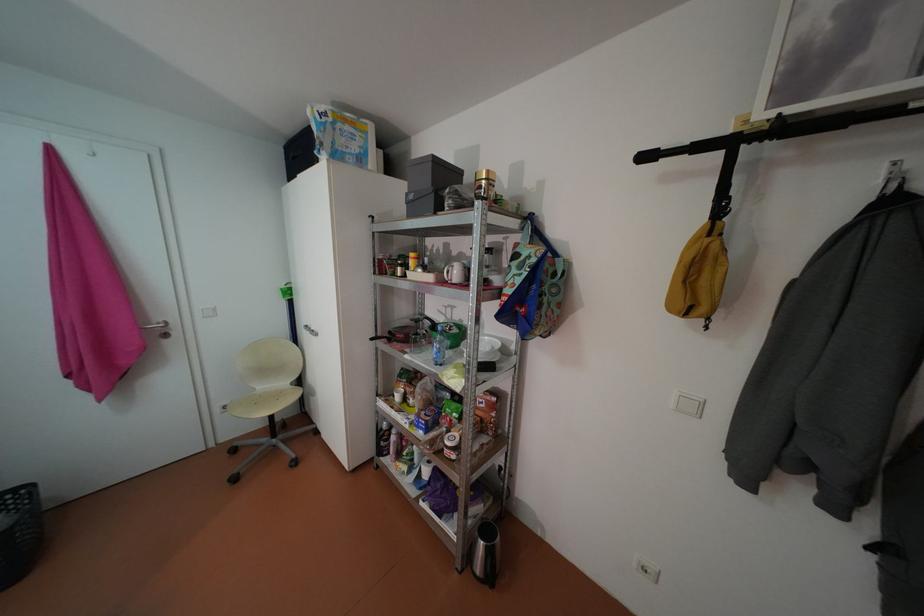
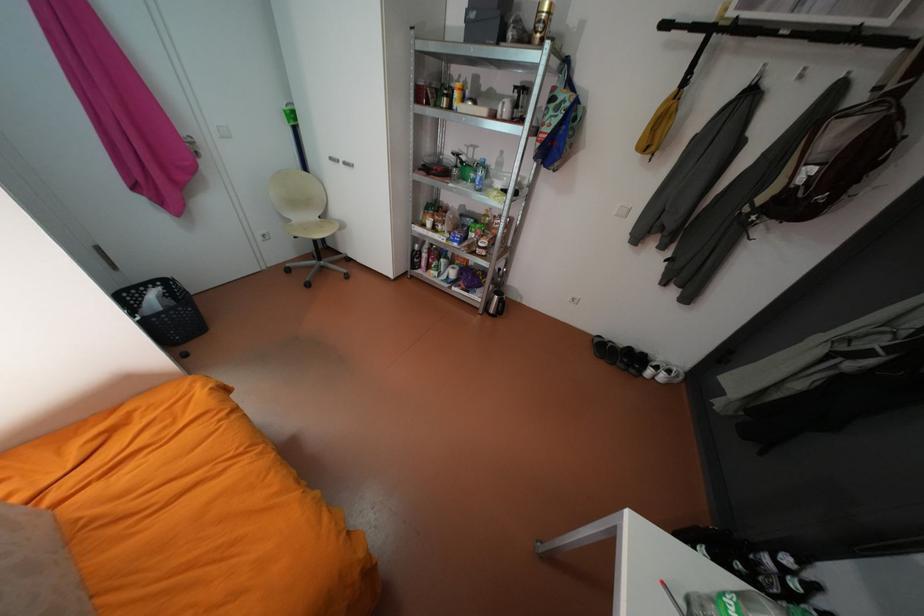
In the second image, find the point that corresponds to point (391, 450) in the first image.

(423, 265)